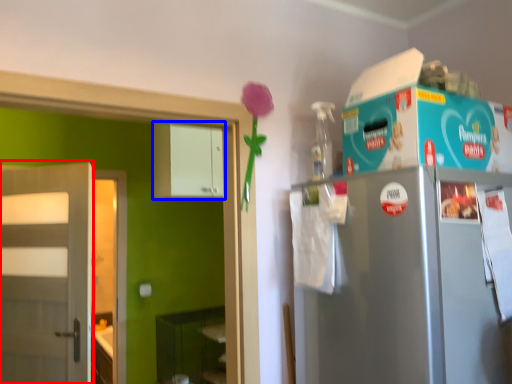
Question: Which object appears farthest to the camera in this image, door (highlighted by a red box) or cabinetry (highlighted by a blue box)?

Choices:
 (A) door
 (B) cabinetry

Answer: (B)